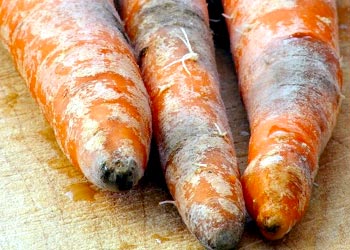
Where is `table`? This screenshot has height=250, width=350. table is located at coordinates (62, 186).